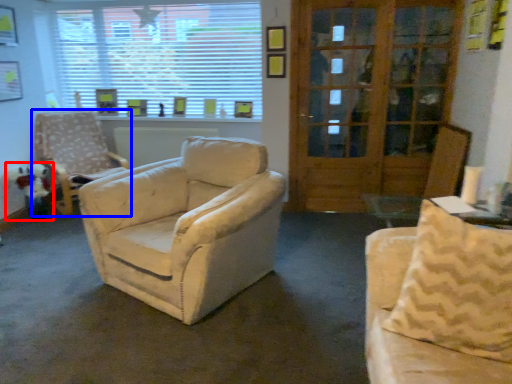
Question: Among these objects, which one is nearest to the camera, toy (highlighted by a red box) or chair (highlighted by a blue box)?

Choices:
 (A) toy
 (B) chair

Answer: (B)